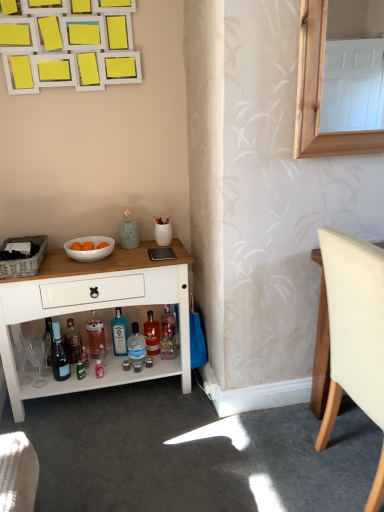
Where is `empty space that is ontop of matte black picnic basket at left (from a real-world perspective)`? The height and width of the screenshot is (512, 384). empty space that is ontop of matte black picnic basket at left (from a real-world perspective) is located at coordinates (19, 241).